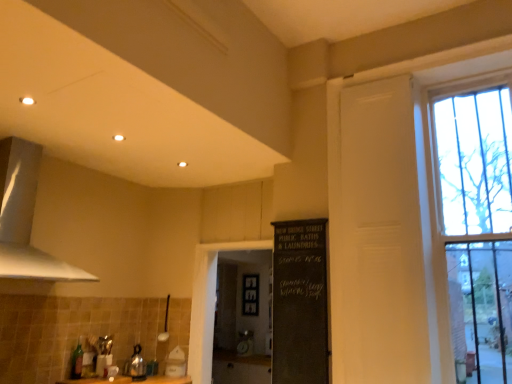
The width and height of the screenshot is (512, 384). In order to click on free space behind green glass bottle at lower left in this screenshot , I will do `click(87, 377)`.